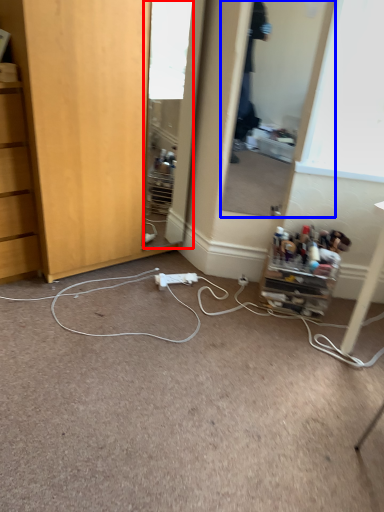
Question: Among these objects, which one is farthest to the camera, mirror (highlighted by a red box) or mirror (highlighted by a blue box)?

Choices:
 (A) mirror
 (B) mirror

Answer: (A)